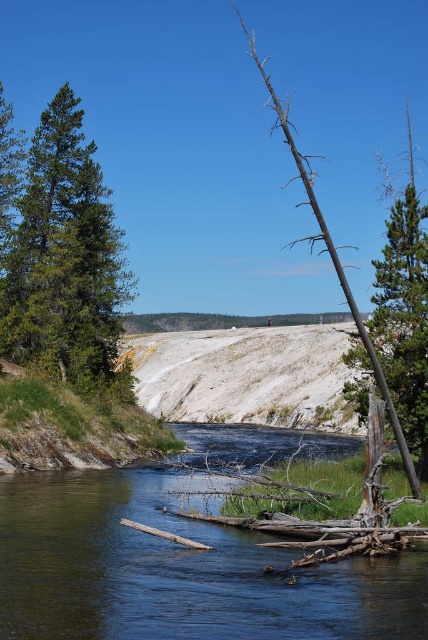
The height and width of the screenshot is (640, 428). In order to click on green matte tree at left in this screenshot , I will do `click(65, 259)`.

Does green matte tree at left come behind brown rough bark tree at right?

That is True.

What do you see at coordinates (65, 259) in the screenshot? This screenshot has height=640, width=428. I see `green matte tree at left` at bounding box center [65, 259].

Locate an element on the screen. This screenshot has width=428, height=640. green matte tree at left is located at coordinates (65, 259).

Does brown rough bark tree at right have a lesser height compared to brown dead wood at right?

Correct, brown rough bark tree at right is not as tall as brown dead wood at right.

Which is in front, point (391, 236) or point (273, 104)?

Point (391, 236)

What do you see at coordinates (404, 308) in the screenshot?
I see `brown rough bark tree at right` at bounding box center [404, 308].

Where is `brown rough bark tree at right`? Image resolution: width=428 pixels, height=640 pixels. brown rough bark tree at right is located at coordinates (404, 308).

Is green matte tree at left smaller than brown dead wood at right?

Yes, green matte tree at left is smaller than brown dead wood at right.

Between green matte tree at left and brown dead wood at right, which one is positioned lower?

green matte tree at left is lower down.

This screenshot has height=640, width=428. Identify the location of green matte tree at left. (65, 259).